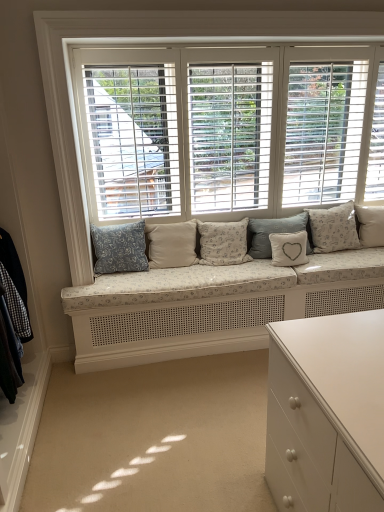
Question: Can you confirm if white textured cushion at center, arranged as the sixth pillow when viewed from the left, is taller than gray fabric pillow at center, the fourth pillow when ordered from right to left?

Choices:
 (A) no
 (B) yes

Answer: (B)

Question: Would you say white textured cushion at center, the 2th pillow positioned from the right, is outside gray fabric pillow at center, the 4th pillow when ordered from left to right?

Choices:
 (A) yes
 (B) no

Answer: (A)

Question: Considering the relative sizes of white textured cushion at center, the 2th pillow positioned from the right, and gray fabric pillow at center, the fourth pillow when ordered from right to left, in the image provided, is white textured cushion at center, the 2th pillow positioned from the right, thinner than gray fabric pillow at center, the fourth pillow when ordered from right to left,?

Choices:
 (A) no
 (B) yes

Answer: (A)

Question: Is gray fabric pillow at center, the 4th pillow when ordered from left to right, a part of white textured cushion at center, arranged as the sixth pillow when viewed from the left?

Choices:
 (A) no
 (B) yes

Answer: (A)

Question: Does white textured cushion at center, arranged as the sixth pillow when viewed from the left, have a smaller size compared to gray fabric pillow at center, the 4th pillow when ordered from left to right?

Choices:
 (A) no
 (B) yes

Answer: (A)

Question: Does point (139, 242) appear closer or farther from the camera than point (163, 110)?

Choices:
 (A) closer
 (B) farther

Answer: (B)

Question: In the image, is blue floral fabric pillow at center, which ranks as the 7th pillow in right-to-left order, on the left side or the right side of white wood window at center?

Choices:
 (A) left
 (B) right

Answer: (A)

Question: In terms of size, does blue floral fabric pillow at center, the first pillow when ordered from left to right, appear bigger or smaller than white wood window at center?

Choices:
 (A) big
 (B) small

Answer: (B)

Question: From the image's perspective, is blue floral fabric pillow at center, which ranks as the 7th pillow in right-to-left order, above or below white wood window at center?

Choices:
 (A) below
 (B) above

Answer: (A)

Question: Visually, is fluffy white pillow at center, arranged as the fifth pillow when viewed from the right, positioned to the left or to the right of white textured pillow at right, placed as the seventh pillow when sorted from left to right?

Choices:
 (A) right
 (B) left

Answer: (B)

Question: In the image, is fluffy white pillow at center, the third pillow when ordered from left to right, positioned in front of or behind white textured pillow at right, which appears as the first pillow when viewed from the right?

Choices:
 (A) front
 (B) behind

Answer: (A)

Question: In terms of size, does fluffy white pillow at center, the third pillow when ordered from left to right, appear bigger or smaller than white textured pillow at right, which appears as the first pillow when viewed from the right?

Choices:
 (A) small
 (B) big

Answer: (B)

Question: In terms of height, does fluffy white pillow at center, arranged as the fifth pillow when viewed from the right, look taller or shorter compared to white textured pillow at right, which appears as the first pillow when viewed from the right?

Choices:
 (A) tall
 (B) short

Answer: (A)

Question: Considering the positions of blue floral fabric pillow at center, the first pillow when ordered from left to right, and white textured pillow at center, the 5th pillow when ordered from left to right, in the image, is blue floral fabric pillow at center, the first pillow when ordered from left to right, bigger or smaller than white textured pillow at center, the 5th pillow when ordered from left to right,?

Choices:
 (A) small
 (B) big

Answer: (B)

Question: From the image's perspective, relative to white textured pillow at center, the 5th pillow when ordered from left to right, is blue floral fabric pillow at center, which ranks as the 7th pillow in right-to-left order, above or below?

Choices:
 (A) above
 (B) below

Answer: (A)